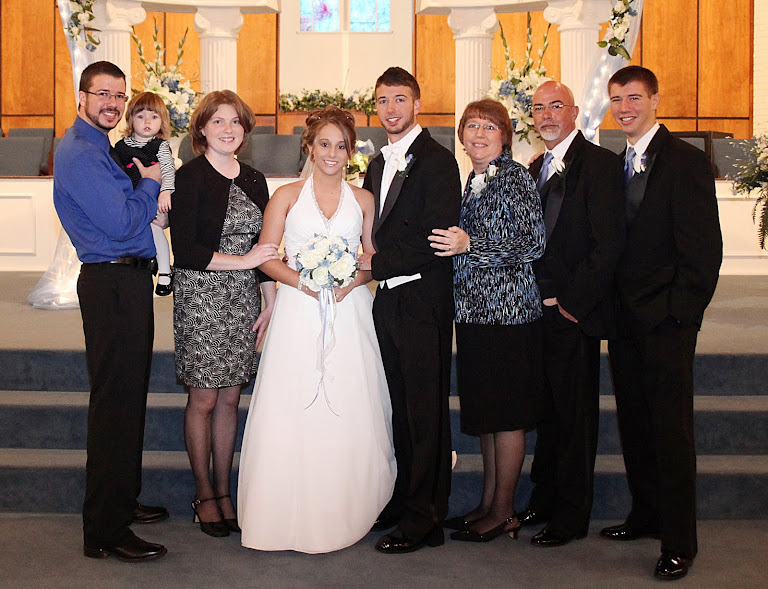
What are the coordinates of `floral wreath` in the screenshot? It's located at (80, 21), (614, 34).